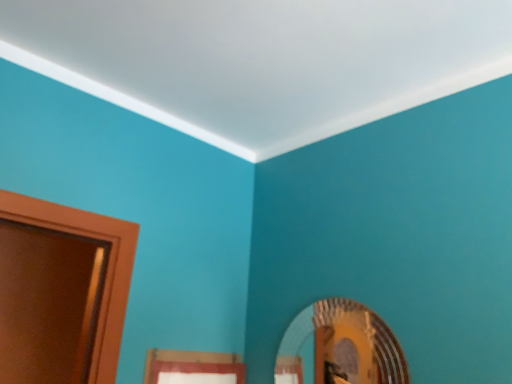
Image resolution: width=512 pixels, height=384 pixels. What are the coordinates of `gold textured mirror at lower right` in the screenshot? It's located at (344, 346).

What do you see at coordinates (344, 346) in the screenshot? I see `gold textured mirror at lower right` at bounding box center [344, 346].

Image resolution: width=512 pixels, height=384 pixels. Identify the location of gold textured mirror at lower right. (344, 346).